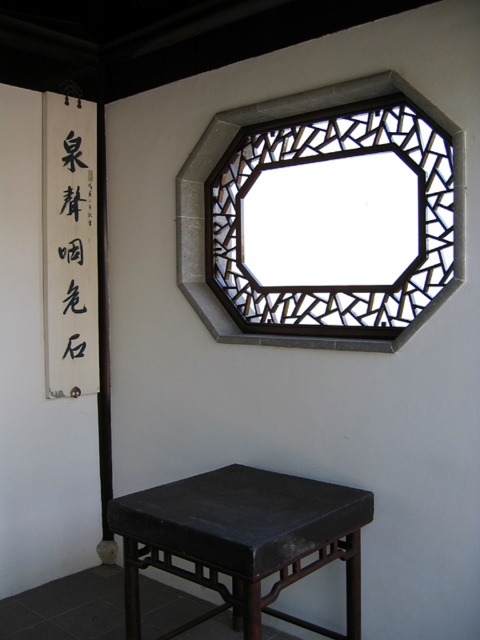
You are standing in the room and want to touch both the black lattice window at upper center and the black paper calligraphy at left. Which object will you reach first?

You will reach the black lattice window at upper center first because it is closer to you than the black paper calligraphy at left.

You are arranging a tea ceremony set on the matte black table at lower center. You have a black paper calligraphy at left that you want to place on the table. Will it fit on the table?

The matte black table at lower center has a larger width than the black paper calligraphy at left, so the calligraphy will fit on the table.

You are arranging a tea ceremony set on the matte black table at lower center and the black lattice window at upper center. Which surface can accommodate a larger tea set?

The black lattice window at upper center has a larger size compared to the matte black table at lower center, so it can accommodate a larger tea set.